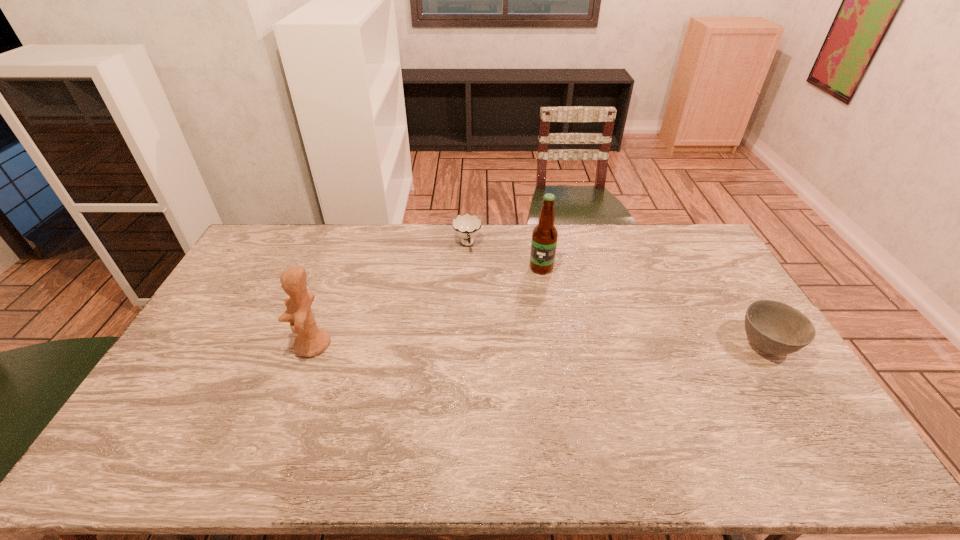
This screenshot has width=960, height=540. In order to click on vacant spot on the desktop that is between the leftmost object and the bowl and is positioned on the side of the third object from right to left with the handle in this screenshot , I will do 488,345.

The height and width of the screenshot is (540, 960). In order to click on vacant space on the desktop that is between the leftmost object and the bowl and is positioned on the label of the third nearest object in this screenshot , I will do `click(489, 345)`.